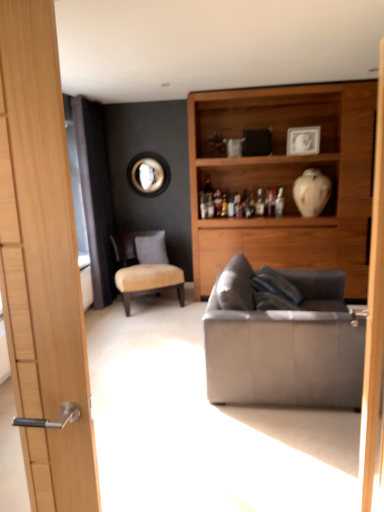
Question: From the image's perspective, is suede gray couch at right on top of white glossy vase at upper right?

Choices:
 (A) no
 (B) yes

Answer: (A)

Question: Is suede gray couch at right beside white glossy vase at upper right?

Choices:
 (A) yes
 (B) no

Answer: (B)

Question: Is suede gray couch at right looking in the opposite direction of white glossy vase at upper right?

Choices:
 (A) no
 (B) yes

Answer: (A)

Question: Considering the relative sizes of suede gray couch at right and white glossy vase at upper right in the image provided, is suede gray couch at right taller than white glossy vase at upper right?

Choices:
 (A) yes
 (B) no

Answer: (A)

Question: Is suede gray couch at right thinner than white glossy vase at upper right?

Choices:
 (A) yes
 (B) no

Answer: (B)

Question: Looking at their shapes, would you say metallic circular mirror at upper center is wider or thinner than beige fabric chair at center?

Choices:
 (A) thin
 (B) wide

Answer: (A)

Question: Is point (148, 185) closer or farther from the camera than point (114, 279)?

Choices:
 (A) closer
 (B) farther

Answer: (B)

Question: From the image's perspective, is metallic circular mirror at upper center above or below beige fabric chair at center?

Choices:
 (A) above
 (B) below

Answer: (A)

Question: From a real-world perspective, is metallic circular mirror at upper center physically located above or below beige fabric chair at center?

Choices:
 (A) above
 (B) below

Answer: (A)

Question: Is point 220,309 positioned closer to the camera than point 145,158?

Choices:
 (A) closer
 (B) farther

Answer: (A)

Question: Which is correct: suede gray couch at right is inside metallic circular mirror at upper center, or outside of it?

Choices:
 (A) outside
 (B) inside

Answer: (A)

Question: Is suede gray couch at right wider or thinner than metallic circular mirror at upper center?

Choices:
 (A) thin
 (B) wide

Answer: (B)

Question: From the image's perspective, is suede gray couch at right positioned above or below metallic circular mirror at upper center?

Choices:
 (A) above
 (B) below

Answer: (B)

Question: Is point (100, 196) closer or farther from the camera than point (309, 130)?

Choices:
 (A) closer
 (B) farther

Answer: (B)

Question: From a real-world perspective, is black fabric screen door at left positioned above or below white glossy picture frame at upper center?

Choices:
 (A) above
 (B) below

Answer: (B)